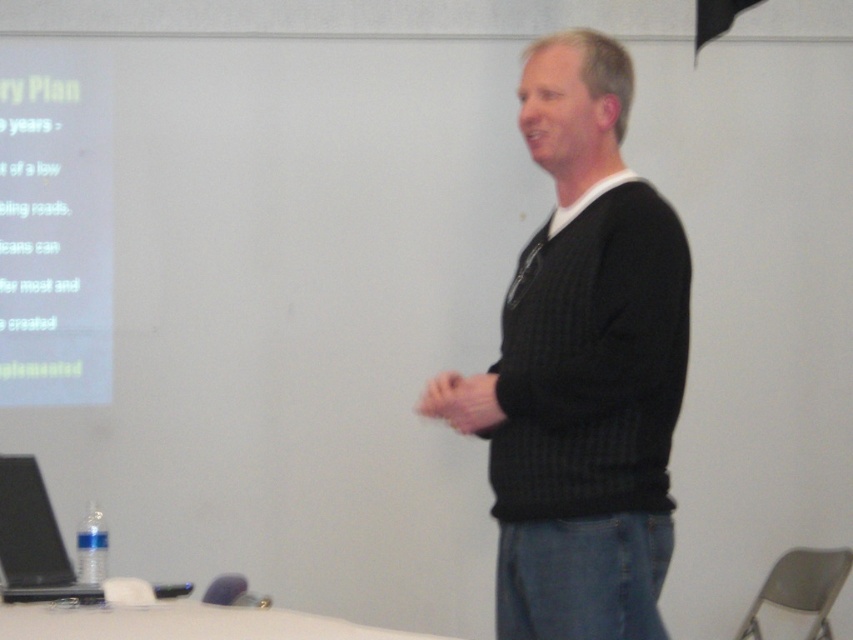
Question: Can you confirm if black knitted sweater at center is positioned below white paper at upper left?

Choices:
 (A) yes
 (B) no

Answer: (A)

Question: Is black knitted sweater at center thinner than white paper at upper left?

Choices:
 (A) yes
 (B) no

Answer: (B)

Question: Which point is closer to the camera taking this photo?

Choices:
 (A) (103, 300)
 (B) (544, 445)
 (C) (15, 465)

Answer: (B)

Question: Can you confirm if white paper at upper left is positioned to the left of black matte laptop at lower left?

Choices:
 (A) yes
 (B) no

Answer: (A)

Question: Which of the following is the closest to the observer?

Choices:
 (A) (53, 397)
 (B) (47, 552)
 (C) (613, 113)

Answer: (C)

Question: Which of the following is the closest to the observer?

Choices:
 (A) white paper at upper left
 (B) black knitted sweater at center

Answer: (B)